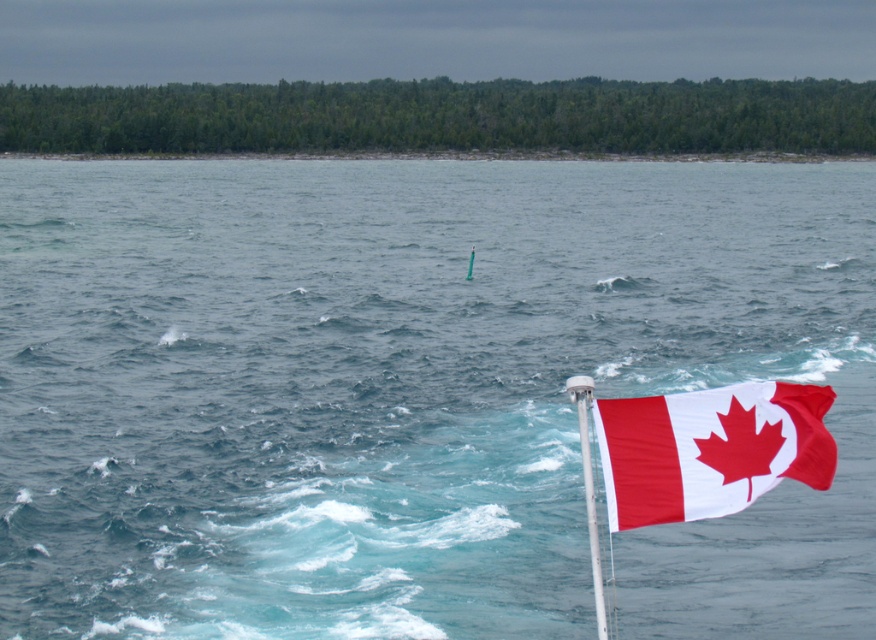
Question: Which of the following is the farthest from the observer?

Choices:
 (A) red fabric maple leaf flag at right
 (B) white plastic pole at right

Answer: (B)

Question: Among these points, which one is farthest from the camera?

Choices:
 (A) (584, 394)
 (B) (668, 404)

Answer: (A)

Question: Can you confirm if red fabric maple leaf flag at right is positioned above white plastic pole at right?

Choices:
 (A) no
 (B) yes

Answer: (B)

Question: Can you confirm if red fabric maple leaf flag at right is bigger than white plastic pole at right?

Choices:
 (A) no
 (B) yes

Answer: (A)

Question: Is red fabric maple leaf flag at right to the left of white plastic pole at right from the viewer's perspective?

Choices:
 (A) yes
 (B) no

Answer: (A)